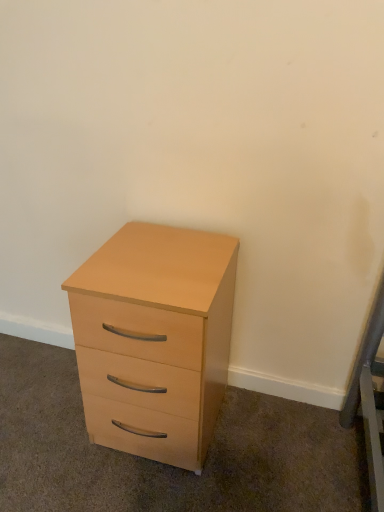
In order to face light wood/veneer chest of drawers at lower left, should I rotate leftwards or rightwards?

Turn left by 4.282 degrees to look at light wood/veneer chest of drawers at lower left.

This screenshot has width=384, height=512. Describe the element at coordinates (158, 332) in the screenshot. I see `light wood/veneer chest of drawers at lower left` at that location.

Where is `light wood/veneer chest of drawers at lower left`? The image size is (384, 512). light wood/veneer chest of drawers at lower left is located at coordinates (158, 332).

At what (x,y) coordinates should I click in order to perform the action: click on light wood/veneer chest of drawers at lower left. Please return your answer as a coordinate pair (x, y). The width and height of the screenshot is (384, 512). Looking at the image, I should click on (158, 332).